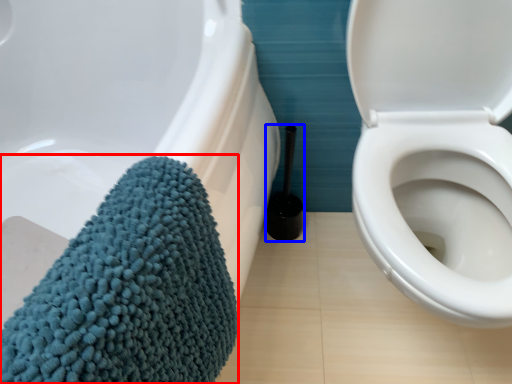
Question: Among these objects, which one is nearest to the camera, bath towel (highlighted by a red box) or brush (highlighted by a blue box)?

Choices:
 (A) bath towel
 (B) brush

Answer: (A)